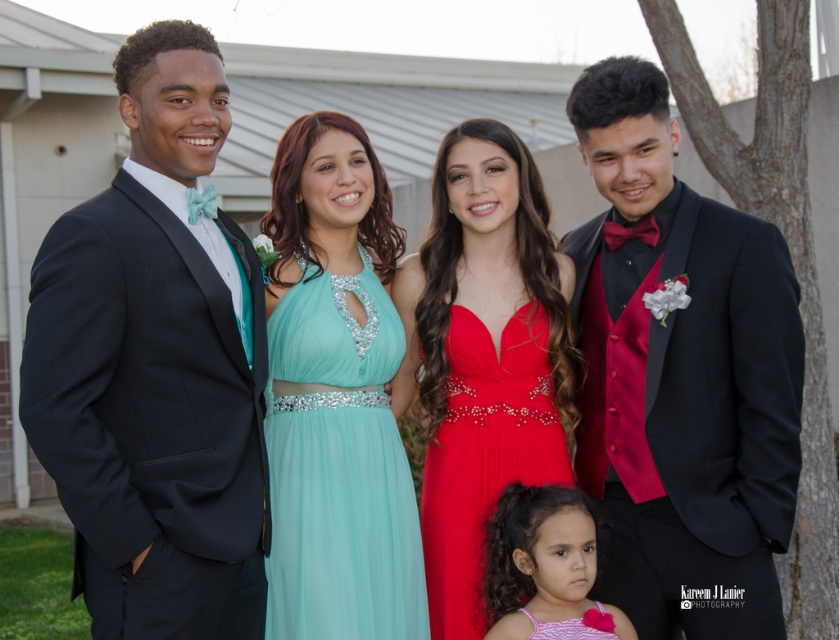
Based on the coordinates provided, which object corresponds to the point at location [155,365]?

The point at location [155,365] corresponds to the matte black suit at left.

You are a photographer at the event and need to adjust the camera angle to capture both the matte black suit at left and the pink satin dress at lower center in focus. Which object should you focus on first to ensure proper depth of field?

The matte black suit at left is taller than the pink satin dress at lower center, so focusing on the taller matte black suit at left first will help ensure both are in focus due to its greater height.